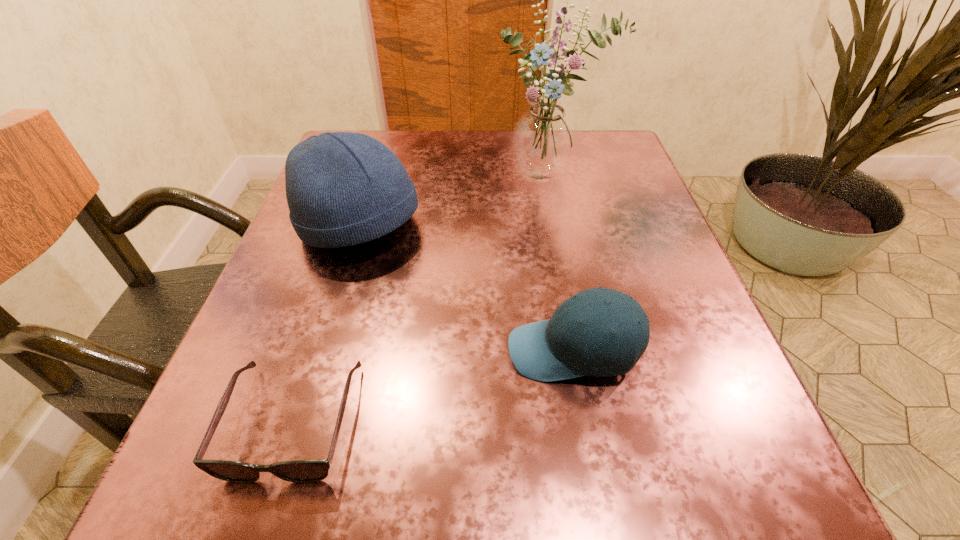
I want to click on empty space between the sunglasses and the baseball cap, so click(x=433, y=386).

Image resolution: width=960 pixels, height=540 pixels. Identify the location of the third closest object to the baseball cap. (544, 139).

Find the location of a particular element. Image resolution: width=960 pixels, height=540 pixels. object that is the second nearest to the skullcap is located at coordinates pos(560,348).

This screenshot has width=960, height=540. Find the location of `vacant region that satisfies the following two spatial constraints: 1. on the front-facing side of the tallest object; 2. on the front-facing side of the baseball cap`. vacant region that satisfies the following two spatial constraints: 1. on the front-facing side of the tallest object; 2. on the front-facing side of the baseball cap is located at coordinates (586, 351).

Where is `free space in the image that satisfies the following two spatial constraints: 1. on the front-facing side of the baseball cap; 2. at the front lenses of the shortest object`? Image resolution: width=960 pixels, height=540 pixels. free space in the image that satisfies the following two spatial constraints: 1. on the front-facing side of the baseball cap; 2. at the front lenses of the shortest object is located at coordinates (586, 421).